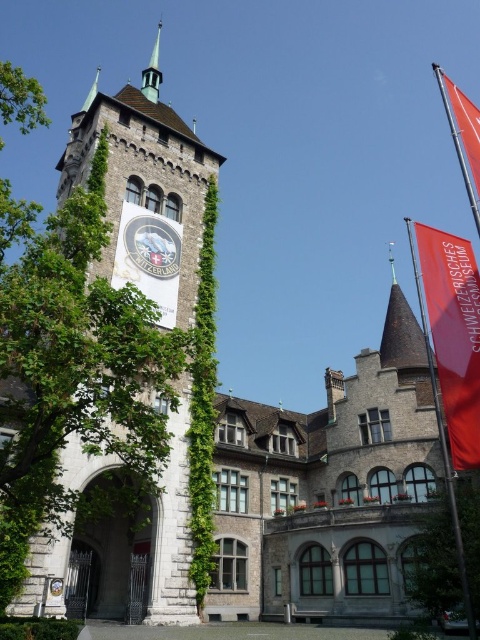
Question: Which point is farther to the camera?

Choices:
 (A) metallic flag pole at upper right
 (B) shiny copper spire at upper center
 (C) red fabric banner at upper right

Answer: (B)

Question: Does red fabric banner at upper right have a greater width compared to shiny copper spire at upper center?

Choices:
 (A) no
 (B) yes

Answer: (A)

Question: Is red fabric banner at upper right to the left of shiny copper spire at upper center from the viewer's perspective?

Choices:
 (A) no
 (B) yes

Answer: (A)

Question: Which of the following is the closest to the observer?

Choices:
 (A) shiny copper spire at upper center
 (B) metallic flag pole at upper right

Answer: (B)

Question: Which point is farther from the camera taking this photo?

Choices:
 (A) (447, 308)
 (B) (159, 28)

Answer: (B)

Question: From the image, what is the correct spatial relationship of red fabric banner at upper right in relation to shiny copper spire at upper center?

Choices:
 (A) above
 (B) below

Answer: (B)